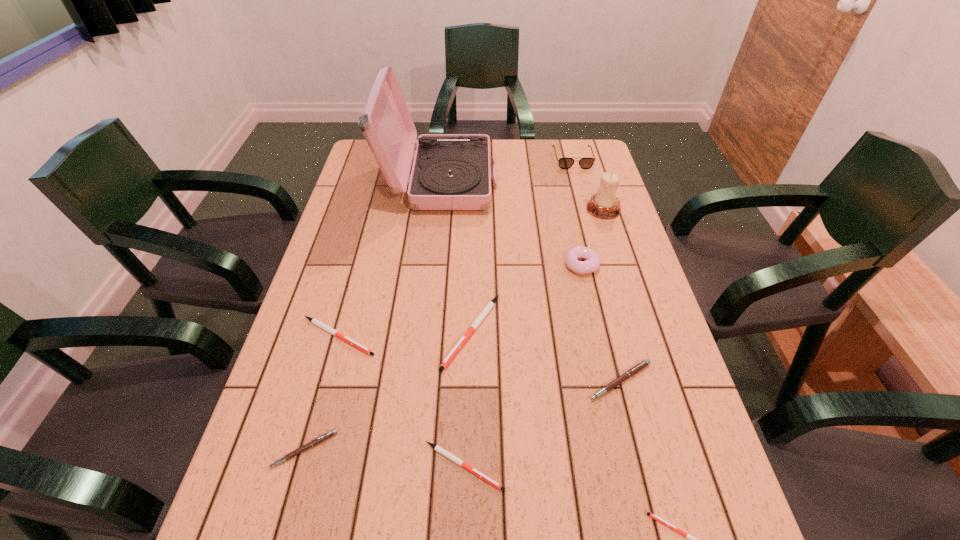
The width and height of the screenshot is (960, 540). I want to click on free spot between the biggest white pen and the third farthest white pen, so click(x=468, y=399).

Where is `blank region between the purple doughnut and the third biggest white pen`? This screenshot has height=540, width=960. blank region between the purple doughnut and the third biggest white pen is located at coordinates (522, 366).

This screenshot has width=960, height=540. Identify the location of the ninth closest object relative to the black spectacles. (692, 539).

Find the location of a particular element. the closest object relative to the biggest white pen is located at coordinates (316, 322).

I want to click on pen that stands as the third closest to the seventh nearest object, so click(x=437, y=448).

Select which pen appears as the third closest to the record player. Please provide its 2D coordinates. Your answer should be formatted as a tuple, i.e. [(x, y)], where the tuple contains the x and y coordinates of a point satisfying the conditions above.

[(637, 368)]

The image size is (960, 540). I want to click on white pen object that ranks as the fourth closest to the nearer pink pen, so click(x=692, y=539).

Point out which white pen is positioned as the second nearest to the third smallest white pen. Please provide its 2D coordinates. Your answer should be formatted as a tuple, i.e. [(x, y)], where the tuple contains the x and y coordinates of a point satisfying the conditions above.

[(437, 448)]

Image resolution: width=960 pixels, height=540 pixels. I want to click on vacant position in the image that satisfies the following two spatial constraints: 1. on the front-facing side of the third tallest object; 2. with the lid open on the tallest object, so click(579, 181).

Locate an element on the screen. The image size is (960, 540). free space that satisfies the following two spatial constraints: 1. on the front side of the second tallest object; 2. on the clicker of the third farthest white pen is located at coordinates click(x=684, y=466).